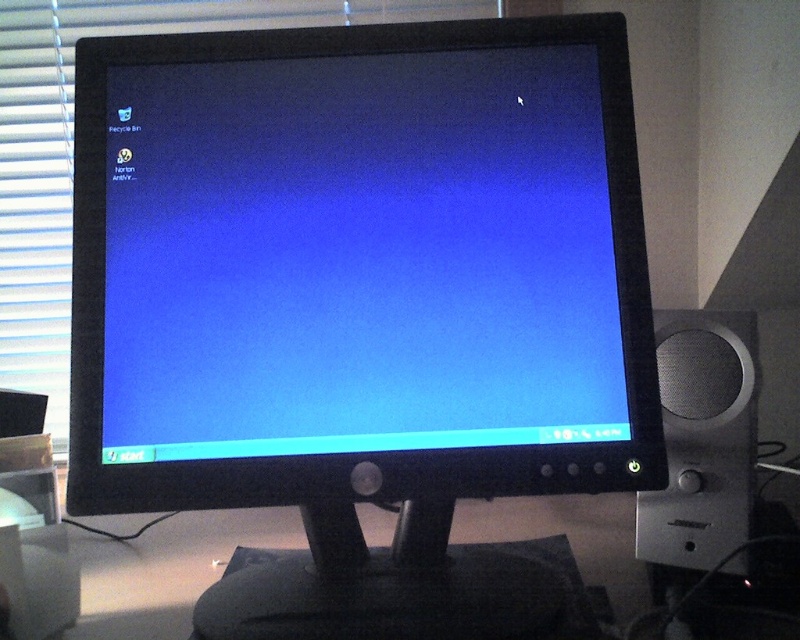
Question: Is black glossy monitor at center above white matte blind at upper left?

Choices:
 (A) yes
 (B) no

Answer: (B)

Question: Is black glossy monitor at center smaller than silver metallic speaker at right?

Choices:
 (A) yes
 (B) no

Answer: (B)

Question: Is black glossy monitor at center thinner than white matte blind at upper left?

Choices:
 (A) no
 (B) yes

Answer: (B)

Question: Which point appears farthest from the camera in this image?

Choices:
 (A) (722, 524)
 (B) (46, 241)
 (C) (522, 316)

Answer: (B)

Question: Which object is farther from the camera taking this photo?

Choices:
 (A) black glossy monitor at center
 (B) white matte blind at upper left

Answer: (B)

Question: Among these points, which one is farthest from the camera?

Choices:
 (A) (229, 227)
 (B) (672, 532)

Answer: (B)